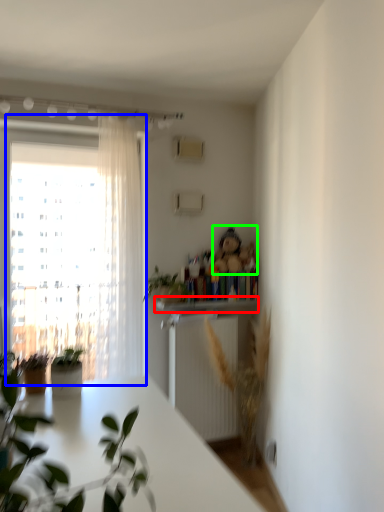
Question: Which object is positioned farthest from window sill (highlighted by a red box)? Select from window (highlighted by a blue box) and toy (highlighted by a green box).

Choices:
 (A) window
 (B) toy

Answer: (A)